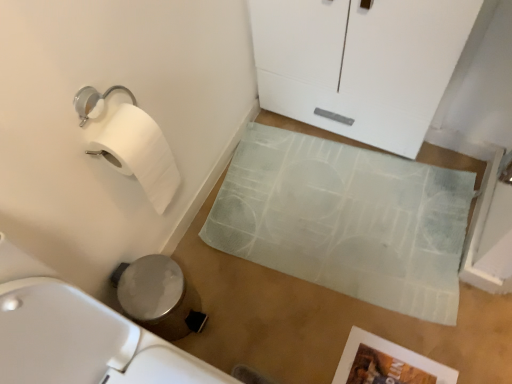
In order to click on white textured bath mat at center in this screenshot , I will do `click(346, 220)`.

Describe the element at coordinates (346, 220) in the screenshot. I see `white textured bath mat at center` at that location.

This screenshot has width=512, height=384. Identify the location of white glossy cabinet at upper center. (x=360, y=64).

What do you see at coordinates (360, 64) in the screenshot? The width and height of the screenshot is (512, 384). I see `white glossy cabinet at upper center` at bounding box center [360, 64].

Measure the distance between point [454,11] and camera.

The distance of point [454,11] from camera is 37.68 inches.

The height and width of the screenshot is (384, 512). Find the location of `white textured bath mat at center`. white textured bath mat at center is located at coordinates (346, 220).

Based on their positions, is white textured bath mat at center located to the left or right of white glossy cabinet at upper center?

Clearly, white textured bath mat at center is on the left of white glossy cabinet at upper center in the image.

Is white textured bath mat at center closer to camera compared to white glossy cabinet at upper center?

No, white textured bath mat at center is further to the viewer.

Does point (419, 173) come closer to viewer compared to point (456, 51)?

That is False.

From the image's perspective, which is below, white textured bath mat at center or white glossy cabinet at upper center?

white textured bath mat at center is shown below in the image.

From a real-world perspective, which is physically above, white textured bath mat at center or white glossy cabinet at upper center?

From a 3D spatial view, white glossy cabinet at upper center is above.

Is white textured bath mat at center wider or thinner than white glossy cabinet at upper center?

Clearly, white textured bath mat at center has more width compared to white glossy cabinet at upper center.

Which of these two, white textured bath mat at center or white glossy cabinet at upper center, stands shorter?

Standing shorter between the two is white textured bath mat at center.

Is white textured bath mat at center smaller than white glossy cabinet at upper center?

Correct, white textured bath mat at center occupies less space than white glossy cabinet at upper center.

Would you say white textured bath mat at center is inside or outside white glossy cabinet at upper center?

white textured bath mat at center lies outside white glossy cabinet at upper center.

Is white textured bath mat at center not near white glossy cabinet at upper center?

No, white textured bath mat at center is not far from white glossy cabinet at upper center.

Could you tell me if white textured bath mat at center is turned towards white glossy cabinet at upper center?

No.

What's the angular difference between white textured bath mat at center and white glossy cabinet at upper center's facing directions?

The facing directions of white textured bath mat at center and white glossy cabinet at upper center are 7.26 degrees apart.

Locate an element on the screen. This screenshot has height=384, width=512. bath mat on the left of white glossy cabinet at upper center is located at coordinates (346, 220).

Is white glossy cabinet at upper center at the right side of white textured bath mat at center?

Correct, you'll find white glossy cabinet at upper center to the right of white textured bath mat at center.

Who is more distant, white glossy cabinet at upper center or white textured bath mat at center?

white textured bath mat at center is further from the camera.

Considering the positions of points (441, 5) and (220, 212), is point (441, 5) closer to camera compared to point (220, 212)?

That is True.

From the image's perspective, would you say white glossy cabinet at upper center is positioned over white textured bath mat at center?

Correct, white glossy cabinet at upper center appears higher than white textured bath mat at center in the image.

From the picture: From a real-world perspective, who is located higher, white glossy cabinet at upper center or white textured bath mat at center?

white glossy cabinet at upper center is physically above.

Between white glossy cabinet at upper center and white textured bath mat at center, which one has larger width?

With larger width is white textured bath mat at center.

Which of these two, white glossy cabinet at upper center or white textured bath mat at center, stands taller?

white glossy cabinet at upper center.

Based on their sizes in the image, would you say white glossy cabinet at upper center is bigger or smaller than white textured bath mat at center?

Clearly, white glossy cabinet at upper center is larger in size than white textured bath mat at center.

Could white textured bath mat at center be considered to be inside white glossy cabinet at upper center?

That's incorrect, white textured bath mat at center is not inside white glossy cabinet at upper center.

Is white glossy cabinet at upper center in contact with white textured bath mat at center?

No, white glossy cabinet at upper center is not beside white textured bath mat at center.

Based on the photo, is white glossy cabinet at upper center turned away from white textured bath mat at center?

No, white textured bath mat at center is not at the back of white glossy cabinet at upper center.

Find the location of a particular element. Image resolution: width=512 pixels, height=384 pixels. glass door to the right of white textured bath mat at center is located at coordinates (360, 64).

Identify the location of glass door positioned vertically above the white textured bath mat at center (from a real-world perspective). This screenshot has height=384, width=512. (360, 64).

Locate an element on the screen. This screenshot has width=512, height=384. bath mat located underneath the white glossy cabinet at upper center (from a real-world perspective) is located at coordinates (346, 220).